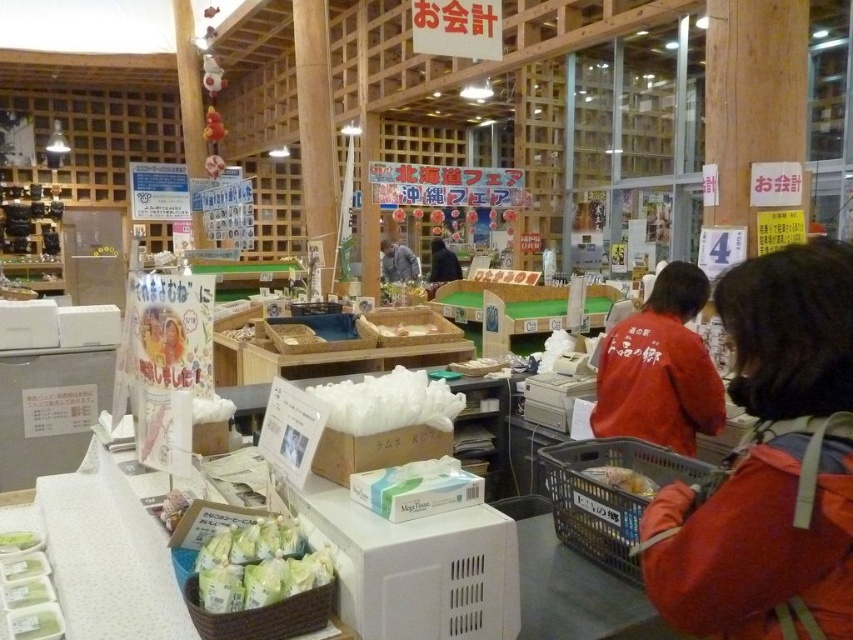
You are a customer at the Japanese grocery store. You want to place a bag of groceries between the plastic basket at lower right and the green leafy vegetables at lower left on the counter. The bag measures 30 inches in length. Will there be enough space to fit it between them?

The distance between the plastic basket at lower right and the green leafy vegetables at lower left is 35.85 inches. Since the bag is 30 inches long, there is sufficient space to fit it between them as the available space is larger than the bag.

You are a customer at the Japanese grocery store and need to place your phone on the counter. The phone is 10 cm wide. Which item, the plastic basket at lower right or the green leafy vegetables at lower left, has enough space to accommodate your phone without overlapping?

The plastic basket at lower right has a larger width than the green leafy vegetables at lower left, so placing the phone next to the plastic basket at lower right would provide sufficient space without overlapping.

You are a customer at the checkout counter in the Japanese grocery store. You need to place your green leafy vegetables from the plastic basket at lower right to the green leafy vegetables at lower left. Which one is taller?

The plastic basket at lower right is much taller than the green leafy vegetables at lower left.